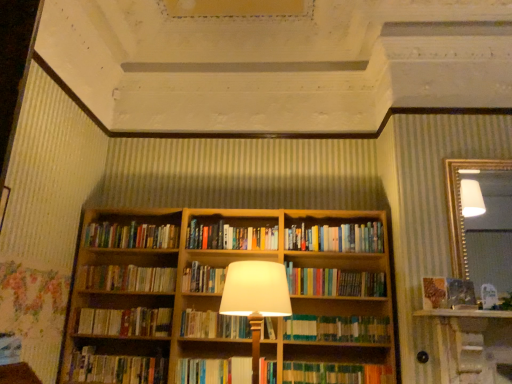
Question: From a real-world perspective, is wooden bookshelf at center above or below matte brown paper at right?

Choices:
 (A) below
 (B) above

Answer: (B)

Question: Is wooden bookshelf at center spatially inside matte brown paper at right, or outside of it?

Choices:
 (A) outside
 (B) inside

Answer: (A)

Question: Considering the real-world distances, which object is farthest from the green textured book at center, the 4th book in the bottom-to-top sequence?

Choices:
 (A) hardcover books at center, which appears as the eighth book when ordered from the bottom
 (B) hardcover books at center, positioned as the 1th book in top-to-bottom order
 (C) multicolored books at center, acting as the fifth book starting from the top
 (D) hardcover books at lower left, the 3th book from the bottom
 (E) hardcover book at center, arranged as the sixth book when viewed from the top

Answer: (D)

Question: Considering the real-world distances, which object is closest to the hardcover book at center, arranged as the sixth book when viewed from the top?

Choices:
 (A) hardcover book at center, acting as the second book starting from the bottom
 (B) matte white lampshade at center
 (C) green textured book at center, the 4th book in the bottom-to-top sequence
 (D) matte brown paper at right
 (E) hardcover books at center, placed as the 11th book when sorted from bottom to top

Answer: (A)